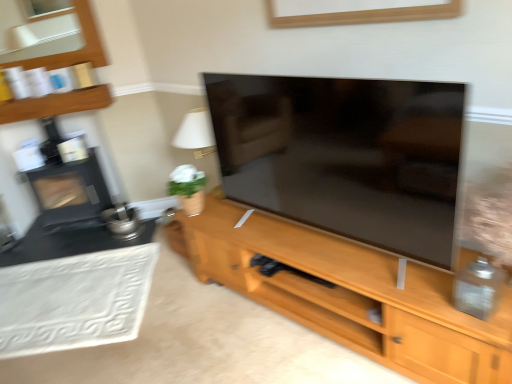
Question: Is point (125, 271) closer or farther from the camera than point (96, 190)?

Choices:
 (A) farther
 (B) closer

Answer: (B)

Question: Would you say white textured rug at lower left is inside or outside black matte fireplace at left?

Choices:
 (A) outside
 (B) inside

Answer: (A)

Question: Which of these objects is positioned farthest from the wooden shelf at upper left?

Choices:
 (A) white textured rug at lower left
 (B) wooden cabinet at center
 (C) black matte fireplace at left

Answer: (B)

Question: Which of these objects is positioned farthest from the black matte fireplace at left?

Choices:
 (A) white textured rug at lower left
 (B) wooden shelf at upper left
 (C) wooden cabinet at center

Answer: (C)